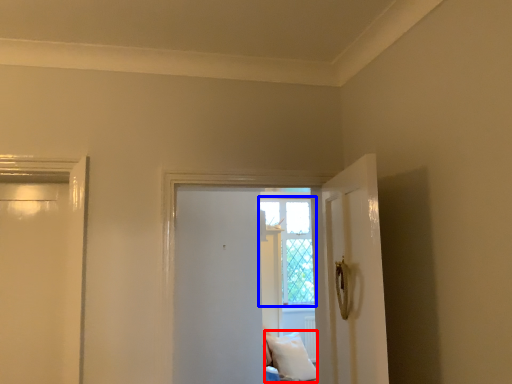
Question: Which object appears farthest to the camera in this image, pillow (highlighted by a red box) or window (highlighted by a blue box)?

Choices:
 (A) pillow
 (B) window

Answer: (B)